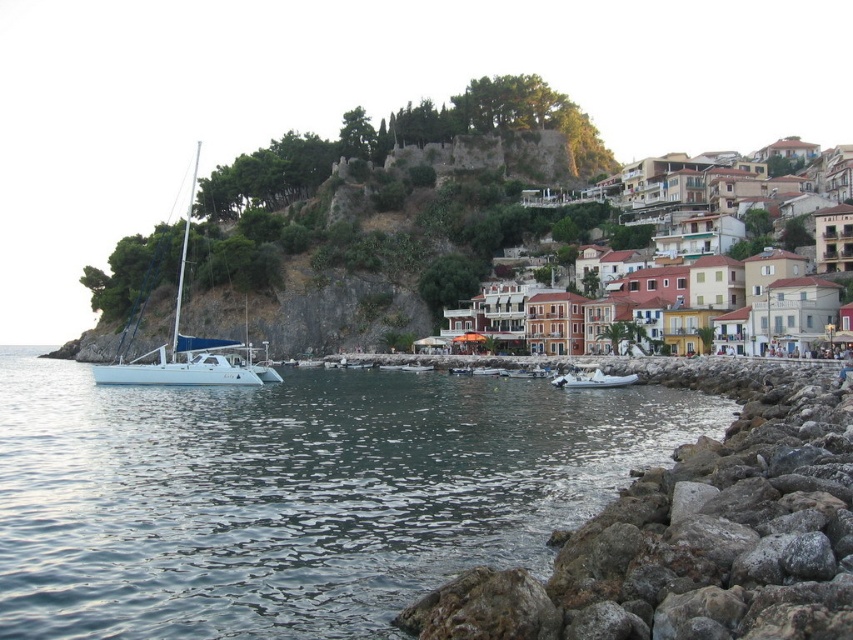
In the scene shown: Does clear water at lower left appear over rockyrough stonerocky shore at lower right?

No.

Who is lower down, clear water at lower left or rockyrough stonerocky shore at lower right?

clear water at lower left is below.

Which is behind, point (88, 561) or point (722, 563)?

The point (88, 561) is more distant.

At what (x,y) coordinates should I click in order to perform the action: click on clear water at lower left. Please return your answer as a coordinate pair (x, y). The image size is (853, 640). Looking at the image, I should click on (294, 493).

You are a GUI agent. You are given a task and a screenshot of the screen. Output one action in this format:
    pyautogui.click(x=<x>, y=<y>)
    Task: Click on the clear water at lower left
    The image size is (853, 640).
    Given the screenshot: What is the action you would take?
    pyautogui.click(x=294, y=493)

Can you confirm if clear water at lower left is bigger than green leafy hillside at upper center?

Actually, clear water at lower left might be smaller than green leafy hillside at upper center.

Which is behind, point (260, 410) or point (465, 243)?

Point (465, 243)

Where is `clear water at lower left`? The height and width of the screenshot is (640, 853). clear water at lower left is located at coordinates point(294,493).

In the scene shown: Can you confirm if clear water at lower left is smaller than white glossy sailboat at left?

Indeed, clear water at lower left has a smaller size compared to white glossy sailboat at left.

Is clear water at lower left bigger than white glossy sailboat at left?

Actually, clear water at lower left might be smaller than white glossy sailboat at left.

Find the location of a particular element. This screenshot has height=640, width=853. clear water at lower left is located at coordinates (294, 493).

Find the location of a particular element. clear water at lower left is located at coordinates (294, 493).